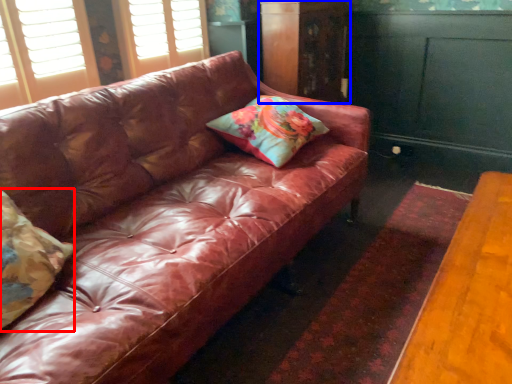
Question: Which object appears closest to the camera in this image, pillow (highlighted by a red box) or dresser (highlighted by a blue box)?

Choices:
 (A) pillow
 (B) dresser

Answer: (A)